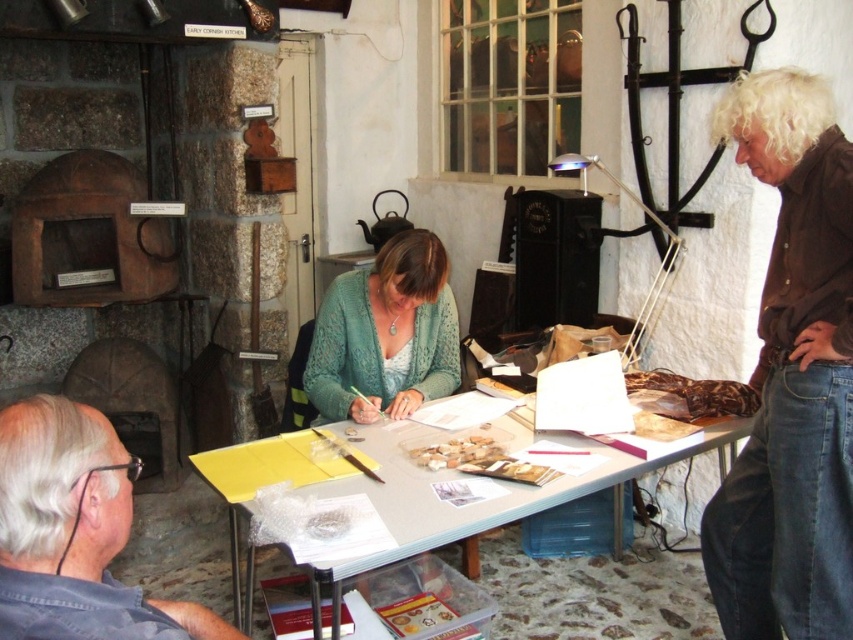
You are standing in the Early Cornish Kitchen exhibit and notice two points marked on the floor. The first point is at coordinates point (801, 257) and the second is at point (421, 316). Which point is closer to you?

Point (801, 257) is closer to the viewer than point (421, 316).